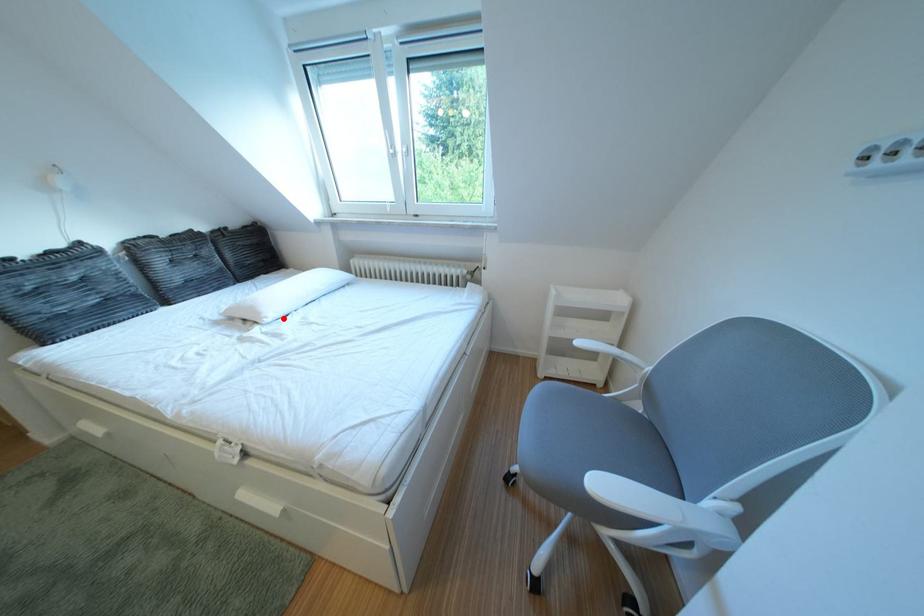
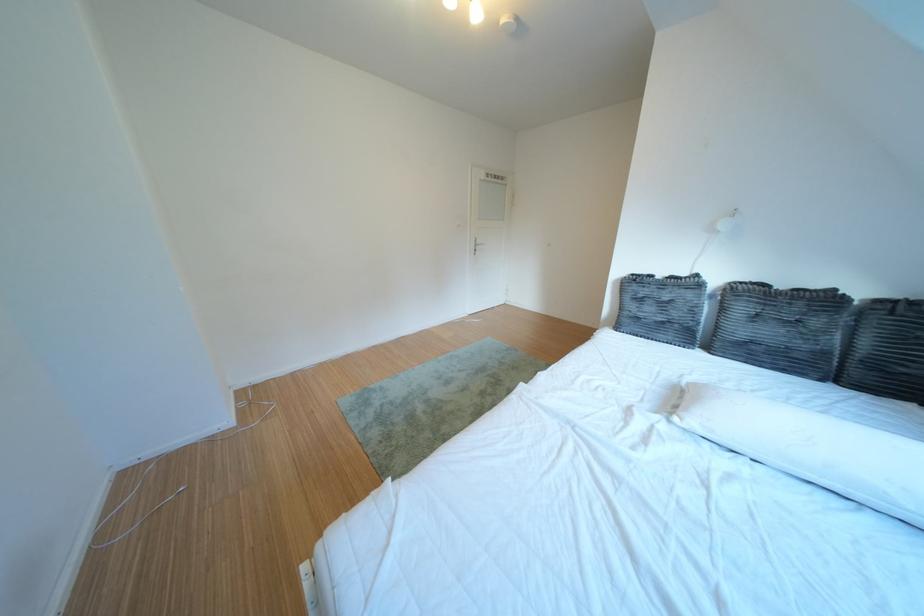
In the second image, find the point that corresponds to the highlighted location in the first image.

(707, 424)